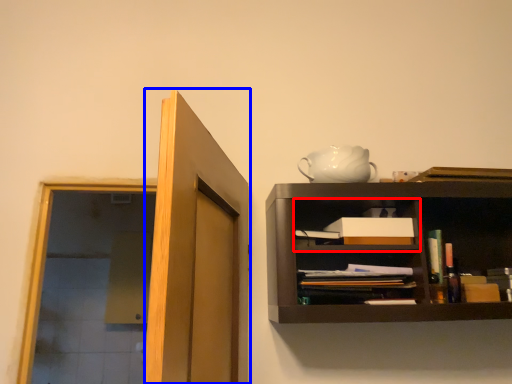
Question: Which object appears farthest to the camera in this image, cabinet (highlighted by a red box) or door (highlighted by a blue box)?

Choices:
 (A) cabinet
 (B) door

Answer: (A)